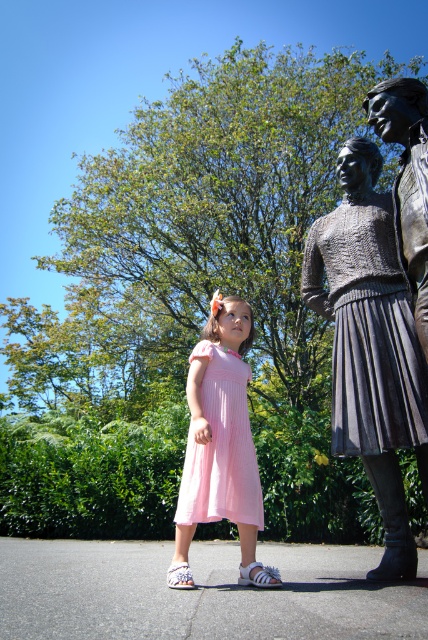
You are a photographer planning to take a photo of both bronze statue at right and bronze statue at upper right. Since you want to capture their full figures, which statue should you focus on first to ensure it fits within your camera frame?

You should focus on the bronze statue at right first because its width is larger than the bronze statue at upper right, so it requires more space in the frame.

Looking at this image, you are a tourist visiting a park and see the bronze statue at right and the bronze statue at upper right. Which one is located more to the right side?

The bronze statue at right is positioned on the right side of bronze statue at upper right, so the bronze statue at right is more to the right.